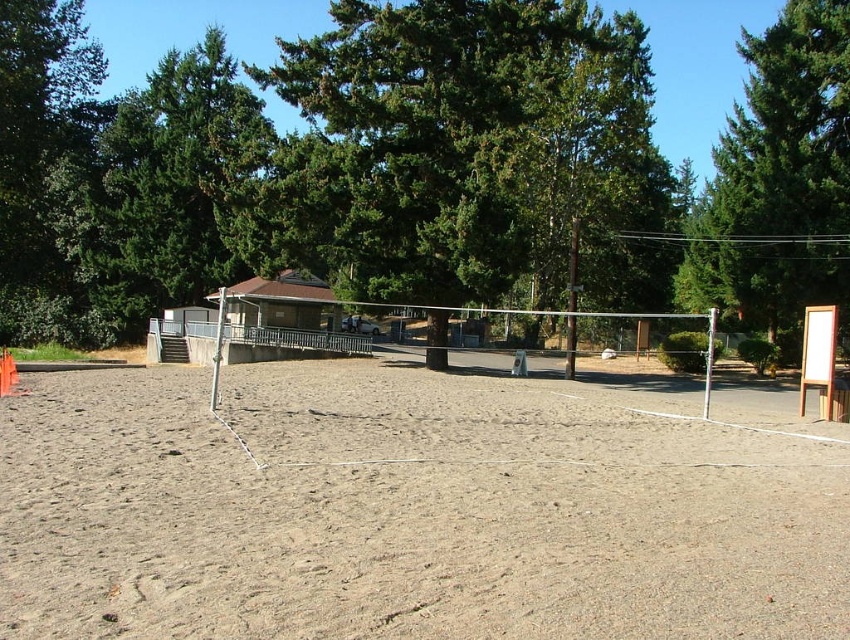
Question: Does brown sandy beach at center have a smaller size compared to green textured tree at upper right?

Choices:
 (A) yes
 (B) no

Answer: (A)

Question: Can you confirm if brown sandy beach at center is positioned to the right of green textured tree at upper right?

Choices:
 (A) yes
 (B) no

Answer: (B)

Question: Which of the following is the closest to the observer?

Choices:
 (A) (756, 74)
 (B) (485, 83)
 (C) (828, 499)

Answer: (C)

Question: Among these points, which one is nearest to the camera?

Choices:
 (A) (502, 132)
 (B) (741, 310)
 (C) (778, 628)

Answer: (C)

Question: Is brown sandy beach at center bigger than green leafy tree at center?

Choices:
 (A) no
 (B) yes

Answer: (A)

Question: Which object is the farthest from the green leafy tree at center?

Choices:
 (A) green textured tree at upper right
 (B) brown sandy beach at center

Answer: (B)